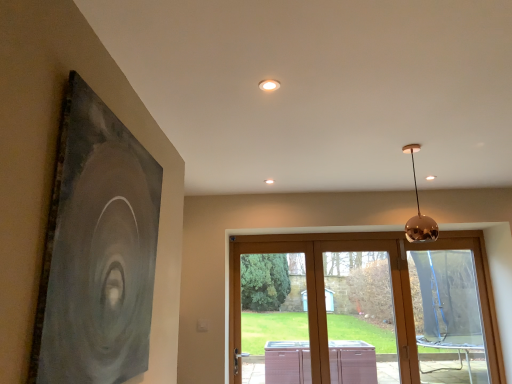
The height and width of the screenshot is (384, 512). What do you see at coordinates (360, 317) in the screenshot? I see `clear glass door at center, the 1th window in the left-to-right sequence` at bounding box center [360, 317].

Identify the location of clear glass door at center, the third window when ordered from right to left. This screenshot has height=384, width=512. 360,317.

Describe the element at coordinates (419, 212) in the screenshot. I see `polished copper sphere at upper right` at that location.

Locate an element on the screen. The height and width of the screenshot is (384, 512). wooden sliding door at center, acting as the second window starting from the right is located at coordinates (366, 309).

Where is `matte black painting at left`? matte black painting at left is located at coordinates [x=97, y=250].

At what (x,y) coordinates should I click in order to perform the action: click on white glossy light fixture at upper center. Please return your answer as a coordinate pair (x, y). The image size is (512, 384). Looking at the image, I should click on (269, 85).

Where is `clear glass door at center, the third window when ordered from right to left`? This screenshot has width=512, height=384. clear glass door at center, the third window when ordered from right to left is located at coordinates (360, 317).

Is polished copper sphere at upper right not within white glossy light fixture at upper center?

That's correct, polished copper sphere at upper right is outside of white glossy light fixture at upper center.

Which is more to the right, polished copper sphere at upper right or white glossy light fixture at upper center?

polished copper sphere at upper right is more to the right.

Is polished copper sphere at upper right positioned with its back to white glossy light fixture at upper center?

No, polished copper sphere at upper right's orientation is not away from white glossy light fixture at upper center.

Is polished copper sphere at upper right completely or partially outside of transparent plastic window at lower right, which appears as the 1th window when viewed from the right?

Yes, polished copper sphere at upper right is outside of transparent plastic window at lower right, which appears as the 1th window when viewed from the right.

Between polished copper sphere at upper right and transparent plastic window at lower right, the third window positioned from the left, which one has larger size?

transparent plastic window at lower right, the third window positioned from the left.

Between polished copper sphere at upper right and transparent plastic window at lower right, which appears as the 1th window when viewed from the right, which one appears on the left side from the viewer's perspective?

From the viewer's perspective, polished copper sphere at upper right appears more on the left side.

From a real-world perspective, which is physically below, polished copper sphere at upper right or transparent plastic window at lower right, the third window positioned from the left?

transparent plastic window at lower right, the third window positioned from the left.

Does point (417, 192) come in front of point (443, 367)?

Yes, point (417, 192) is closer to viewer.

Are polished copper sphere at upper right and wooden sliding door at center, acting as the second window starting from the right, located far from each other?

Yes, polished copper sphere at upper right and wooden sliding door at center, acting as the second window starting from the right, are quite far apart.

Who is more distant, polished copper sphere at upper right or wooden sliding door at center, acting as the second window starting from the right?

wooden sliding door at center, acting as the second window starting from the right, is more distant.

Would you say polished copper sphere at upper right is to the left or to the right of wooden sliding door at center, arranged as the second window when viewed from the left, in the picture?

polished copper sphere at upper right is positioned on wooden sliding door at center, arranged as the second window when viewed from the left,'s left side.

Looking at this image, is transparent plastic window at lower right, the third window positioned from the left, bigger or smaller than wooden sliding door at center, acting as the second window starting from the right?

transparent plastic window at lower right, the third window positioned from the left, is smaller than wooden sliding door at center, acting as the second window starting from the right.

Relative to wooden sliding door at center, arranged as the second window when viewed from the left, is transparent plastic window at lower right, which appears as the 1th window when viewed from the right, in front or behind?

Visually, transparent plastic window at lower right, which appears as the 1th window when viewed from the right, is located behind wooden sliding door at center, arranged as the second window when viewed from the left.

Considering the relative sizes of transparent plastic window at lower right, which appears as the 1th window when viewed from the right, and wooden sliding door at center, acting as the second window starting from the right, in the image provided, is transparent plastic window at lower right, which appears as the 1th window when viewed from the right, shorter than wooden sliding door at center, acting as the second window starting from the right,?

No.

From a real-world perspective, which object rests below the other?

wooden sliding door at center, arranged as the second window when viewed from the left, from a real-world perspective.

Could you tell me if wooden sliding door at center, acting as the second window starting from the right, is turned towards white glossy light fixture at upper center?

Yes, wooden sliding door at center, acting as the second window starting from the right, is oriented towards white glossy light fixture at upper center.

From the image's perspective, is wooden sliding door at center, arranged as the second window when viewed from the left, positioned above or below white glossy light fixture at upper center?

From the image's perspective, wooden sliding door at center, arranged as the second window when viewed from the left, appears below white glossy light fixture at upper center.

Is clear glass door at center, the 1th window in the left-to-right sequence, facing towards polished copper sphere at upper right?

Yes, clear glass door at center, the 1th window in the left-to-right sequence, is turned towards polished copper sphere at upper right.

Can you confirm if clear glass door at center, the third window when ordered from right to left, is positioned to the left of polished copper sphere at upper right?

Yes, clear glass door at center, the third window when ordered from right to left, is to the left of polished copper sphere at upper right.

Choose the correct answer: Is clear glass door at center, the 1th window in the left-to-right sequence, inside polished copper sphere at upper right or outside it?

clear glass door at center, the 1th window in the left-to-right sequence, lies outside polished copper sphere at upper right.

Is clear glass door at center, the 1th window in the left-to-right sequence, not close to polished copper sphere at upper right?

Yes, clear glass door at center, the 1th window in the left-to-right sequence, and polished copper sphere at upper right are quite far apart.

Locate an element on the screen. The image size is (512, 384). the 2nd window positioned above the wooden sliding door at center, arranged as the second window when viewed from the left (from the image's perspective) is located at coordinates (448, 314).

Between wooden sliding door at center, arranged as the second window when viewed from the left, and transparent plastic window at lower right, the third window positioned from the left, which one appears on the left side from the viewer's perspective?

wooden sliding door at center, arranged as the second window when viewed from the left, is more to the left.

Which of these two, wooden sliding door at center, arranged as the second window when viewed from the left, or transparent plastic window at lower right, which appears as the 1th window when viewed from the right, stands shorter?

With less height is wooden sliding door at center, arranged as the second window when viewed from the left.

Based on the photo, are wooden sliding door at center, acting as the second window starting from the right, and transparent plastic window at lower right, which appears as the 1th window when viewed from the right, far apart?

Yes, wooden sliding door at center, acting as the second window starting from the right, and transparent plastic window at lower right, which appears as the 1th window when viewed from the right, are located far from each other.

Identify the location of lighting above the polished copper sphere at upper right (from a real-world perspective). The height and width of the screenshot is (384, 512). (269, 85).

From the polished copper sphere at upper right, count 2nd windows backward and point to it. Please provide its 2D coordinates.

[(448, 314)]

Looking at the image, which one is located further to transparent plastic window at lower right, the third window positioned from the left, polished copper sphere at upper right or clear glass door at center, the 1th window in the left-to-right sequence?

Among the two, polished copper sphere at upper right is located further to transparent plastic window at lower right, the third window positioned from the left.

Which object lies nearer to the anchor point matte black painting at left, white glossy light fixture at upper center or wooden sliding door at center, acting as the second window starting from the right?

The object closer to matte black painting at left is white glossy light fixture at upper center.

Which object lies nearer to the anchor point transparent plastic window at lower right, which appears as the 1th window when viewed from the right, clear glass door at center, the third window when ordered from right to left, or polished copper sphere at upper right?

clear glass door at center, the third window when ordered from right to left, lies closer to transparent plastic window at lower right, which appears as the 1th window when viewed from the right, than the other object.

Which object lies further to the anchor point matte black painting at left, wooden sliding door at center, arranged as the second window when viewed from the left, or transparent plastic window at lower right, the third window positioned from the left?

transparent plastic window at lower right, the third window positioned from the left, lies further to matte black painting at left than the other object.

From the image, which object appears to be farther from wooden sliding door at center, acting as the second window starting from the right, matte black painting at left or clear glass door at center, the third window when ordered from right to left?

The object further to wooden sliding door at center, acting as the second window starting from the right, is matte black painting at left.

Based on their spatial positions, is matte black painting at left or clear glass door at center, the third window when ordered from right to left, closer to polished copper sphere at upper right?

matte black painting at left is closer to polished copper sphere at upper right.

Considering their positions, is clear glass door at center, the 1th window in the left-to-right sequence, positioned closer to transparent plastic window at lower right, which appears as the 1th window when viewed from the right, than white glossy light fixture at upper center?

Based on the image, clear glass door at center, the 1th window in the left-to-right sequence, appears to be nearer to transparent plastic window at lower right, which appears as the 1th window when viewed from the right.

When comparing their distances from clear glass door at center, the third window when ordered from right to left, does transparent plastic window at lower right, the third window positioned from the left, or wooden sliding door at center, acting as the second window starting from the right, seem closer?

Among the two, transparent plastic window at lower right, the third window positioned from the left, is located nearer to clear glass door at center, the third window when ordered from right to left.

Where is `lamp between matte black painting at left and clear glass door at center, the 1th window in the left-to-right sequence, along the z-axis`? The height and width of the screenshot is (384, 512). lamp between matte black painting at left and clear glass door at center, the 1th window in the left-to-right sequence, along the z-axis is located at coordinates (419, 212).

The width and height of the screenshot is (512, 384). In order to click on lighting positioned between matte black painting at left and wooden sliding door at center, acting as the second window starting from the right, from near to far in this screenshot , I will do `click(269, 85)`.

Image resolution: width=512 pixels, height=384 pixels. What are the coordinates of `lamp located between white glossy light fixture at upper center and transparent plastic window at lower right, which appears as the 1th window when viewed from the right, in the depth direction` in the screenshot? It's located at (419, 212).

Identify the location of lighting between matte black painting at left and transparent plastic window at lower right, the third window positioned from the left, in the front-back direction. The height and width of the screenshot is (384, 512). (269, 85).